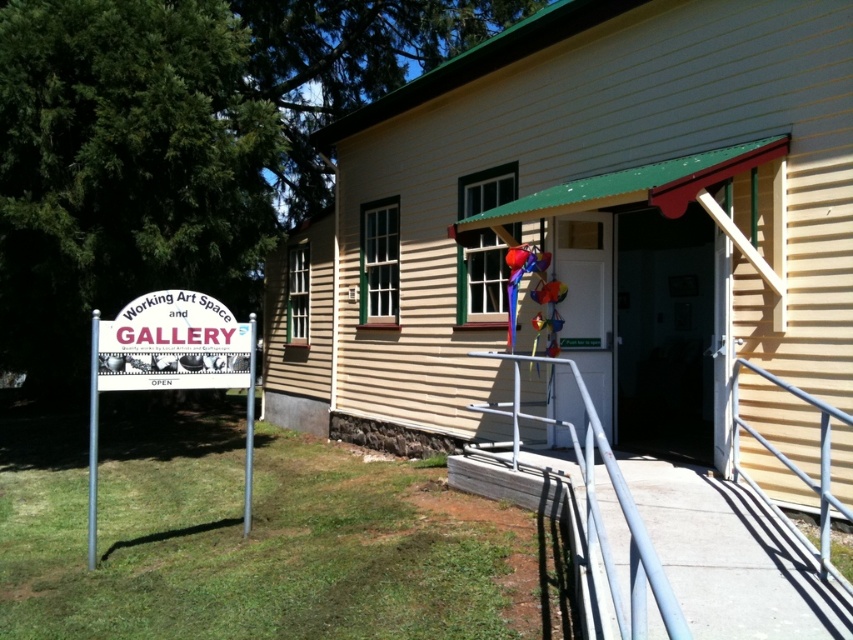
Is white plastic sign at lower left positioned before silver metallic handrail at center?

That is True.

Is white plastic sign at lower left wider than silver metallic handrail at center?

Correct, the width of white plastic sign at lower left exceeds that of silver metallic handrail at center.

The height and width of the screenshot is (640, 853). I want to click on white plastic sign at lower left, so click(169, 364).

Between point (136, 349) and point (189, 314), which one is positioned behind?

The point (189, 314) is behind.

Is white plastic sign at lower left to the right of white plastic sign at left from the viewer's perspective?

No, white plastic sign at lower left is not to the right of white plastic sign at left.

Describe the element at coordinates (169, 364) in the screenshot. I see `white plastic sign at lower left` at that location.

Where is `white plastic sign at lower left`? white plastic sign at lower left is located at coordinates (169, 364).

Does silver metallic handrail at center have a larger size compared to silver metallic handrail at lower right?

No, silver metallic handrail at center is not bigger than silver metallic handrail at lower right.

Where is `silver metallic handrail at center`? silver metallic handrail at center is located at coordinates point(598,508).

Between point (654, 552) and point (827, 573), which one is positioned in front?

Point (654, 552) is more forward.

Identify the location of silver metallic handrail at center. (598, 508).